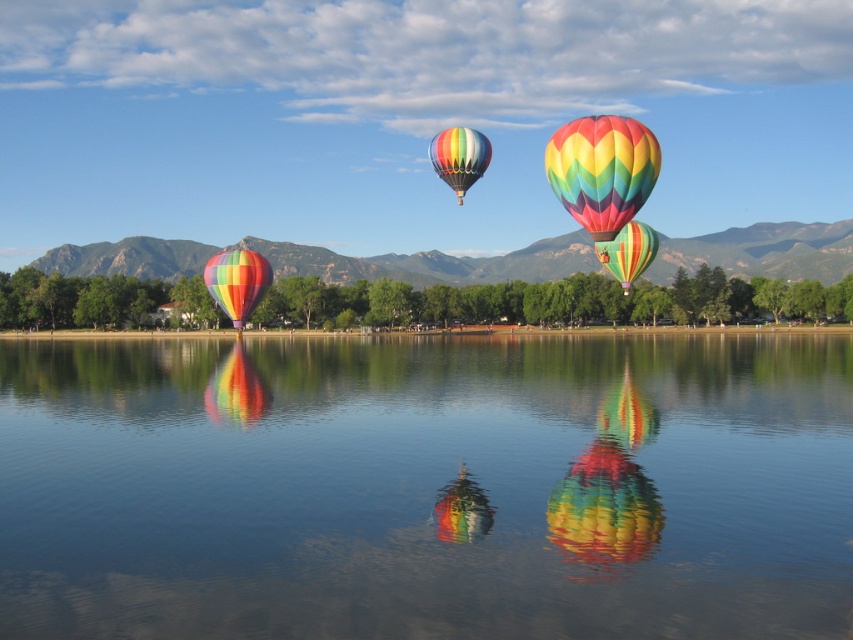
Looking at this image, does multicolored glossy balloon at lower center appear over rainbow fabric balloon at lower left?

No, multicolored glossy balloon at lower center is not above rainbow fabric balloon at lower left.

Is multicolored glossy balloon at lower center positioned at the back of rainbow fabric balloon at lower left?

No, multicolored glossy balloon at lower center is closer to the viewer.

Where is `multicolored glossy balloon at lower center`? The height and width of the screenshot is (640, 853). multicolored glossy balloon at lower center is located at coordinates (608, 490).

Locate an element on the screen. This screenshot has width=853, height=640. multicolored glossy balloon at lower center is located at coordinates (608, 490).

Can you confirm if rainbow fabric balloon at lower left is positioned below multicolored fabric hot air balloon at left?

Yes, rainbow fabric balloon at lower left is below multicolored fabric hot air balloon at left.

Can you confirm if rainbow fabric balloon at lower left is wider than multicolored fabric hot air balloon at left?

Indeed, rainbow fabric balloon at lower left has a greater width compared to multicolored fabric hot air balloon at left.

The width and height of the screenshot is (853, 640). I want to click on rainbow fabric balloon at lower left, so click(x=236, y=388).

This screenshot has width=853, height=640. What are the coordinates of `rainbow fabric balloon at lower left` in the screenshot? It's located at (236, 388).

Who is more forward, (251, 298) or (622, 252)?

Point (622, 252) is more forward.

Does multicolored fabric hot air balloon at left appear on the left side of multicolored fabric hot air balloon at center?

Yes, multicolored fabric hot air balloon at left is to the left of multicolored fabric hot air balloon at center.

Does point (230, 282) come closer to viewer compared to point (630, 260)?

No, (230, 282) is further to viewer.

I want to click on multicolored fabric hot air balloon at left, so click(x=236, y=282).